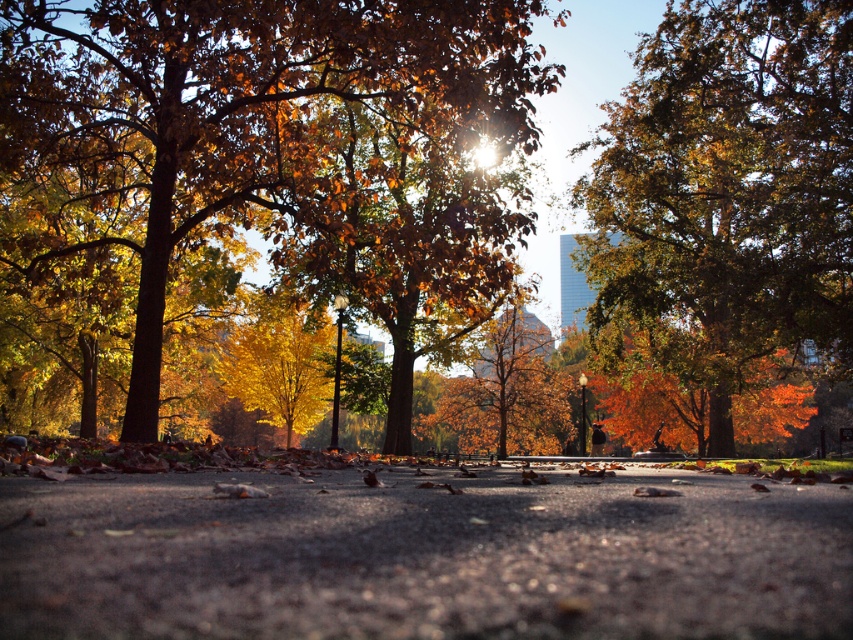
Which of these two, golden leaves at center or golden textured tree at center, stands shorter?

golden textured tree at center is shorter.

Is golden leaves at center shorter than golden textured tree at center?

In fact, golden leaves at center may be taller than golden textured tree at center.

Find the location of a particular element. The width and height of the screenshot is (853, 640). golden leaves at center is located at coordinates (276, 150).

Does golden leaves at center appear on the right side of golden textured leaves at center?

In fact, golden leaves at center is to the left of golden textured leaves at center.

Measure the distance between golden leaves at center and camera.

They are 12.94 meters apart.

Who is more forward, [450,70] or [726,355]?

Positioned in front is point [450,70].

Where is `golden leaves at center`? This screenshot has width=853, height=640. golden leaves at center is located at coordinates (276, 150).

Can you confirm if golden textured leaves at center is taller than golden textured tree at center?

Yes, golden textured leaves at center is taller than golden textured tree at center.

Is golden textured leaves at center positioned behind golden textured tree at center?

No, it is not.

The height and width of the screenshot is (640, 853). I want to click on golden textured leaves at center, so click(x=727, y=195).